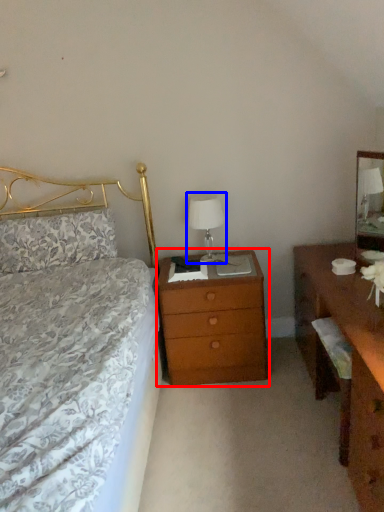
Question: Which object is further to the camera taking this photo, nightstand (highlighted by a red box) or bedside lamp (highlighted by a blue box)?

Choices:
 (A) nightstand
 (B) bedside lamp

Answer: (B)